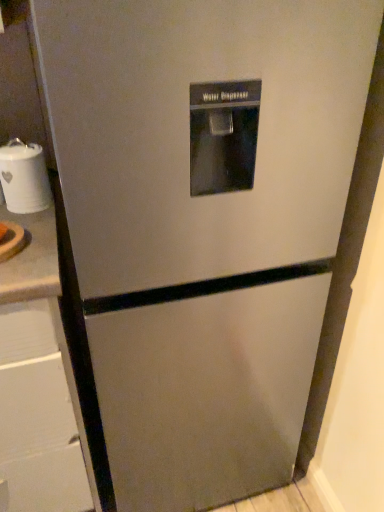
Question: From the image's perspective, is white ceramic jar at left located above brushed metal drawer at left?

Choices:
 (A) yes
 (B) no

Answer: (A)

Question: Can you confirm if white ceramic jar at left is positioned to the right of brushed metal drawer at left?

Choices:
 (A) no
 (B) yes

Answer: (B)

Question: From a real-world perspective, is white ceramic jar at left beneath brushed metal drawer at left?

Choices:
 (A) yes
 (B) no

Answer: (B)

Question: Considering the relative sizes of white ceramic jar at left and brushed metal drawer at left in the image provided, is white ceramic jar at left thinner than brushed metal drawer at left?

Choices:
 (A) no
 (B) yes

Answer: (B)

Question: Is white ceramic jar at left positioned behind brushed metal drawer at left?

Choices:
 (A) no
 (B) yes

Answer: (B)

Question: Is white ceramic jar at left next to brushed metal drawer at left?

Choices:
 (A) no
 (B) yes

Answer: (A)

Question: Is brushed metal drawer at left facing away from white ceramic jar at left?

Choices:
 (A) no
 (B) yes

Answer: (A)

Question: Considering the relative positions of brushed metal drawer at left and white ceramic jar at left in the image provided, is brushed metal drawer at left to the right of white ceramic jar at left from the viewer's perspective?

Choices:
 (A) no
 (B) yes

Answer: (A)

Question: Is brushed metal drawer at left smaller than white ceramic jar at left?

Choices:
 (A) yes
 (B) no

Answer: (B)

Question: Is white ceramic jar at left surrounded by brushed metal drawer at left?

Choices:
 (A) no
 (B) yes

Answer: (A)

Question: Is there a large distance between brushed metal drawer at left and white ceramic jar at left?

Choices:
 (A) no
 (B) yes

Answer: (A)

Question: From the image's perspective, is brushed metal drawer at left located above white ceramic jar at left?

Choices:
 (A) yes
 (B) no

Answer: (B)

Question: Is brushed metal drawer at left taller or shorter than white ceramic jar at left?

Choices:
 (A) short
 (B) tall

Answer: (B)